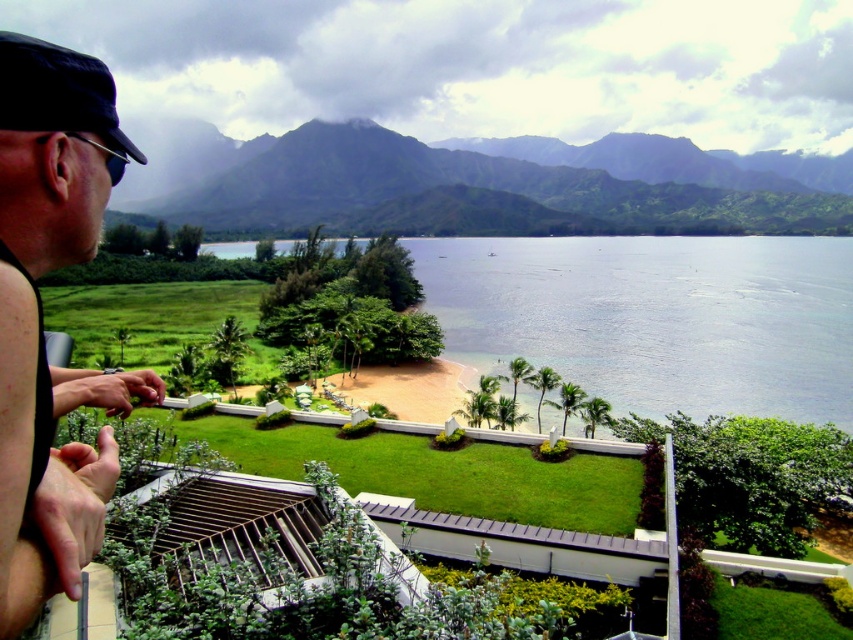
You are a landscape photographer planning to capture the view from this balcony. You notice the green textured mountains at upper center and the green grass at lower center. Which of these two elements would appear more prominent in your photo, and why?

The green textured mountains at upper center would appear more prominent in the photo because they are larger in size than the green grass at lower center.